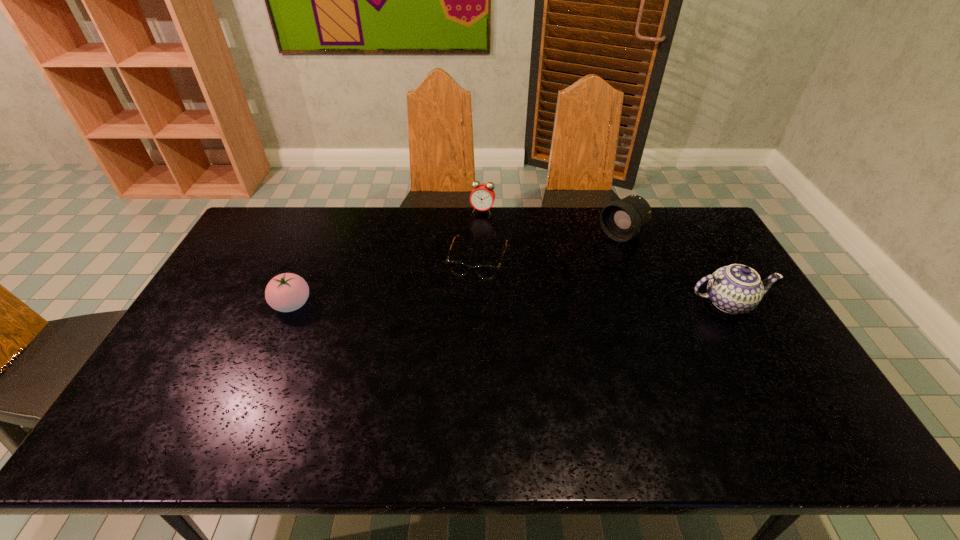
What are the coordinates of `vacant area situated 0.170m at the front element of the telephoto lens` in the screenshot? It's located at (575, 266).

Image resolution: width=960 pixels, height=540 pixels. In order to click on free region located 0.160m at the front element of the telephoto lens in this screenshot , I will do `click(577, 265)`.

You are a GUI agent. You are given a task and a screenshot of the screen. Output one action in this format:
    pyautogui.click(x=<x>, y=<y>)
    Task: Click on the vacant space situated at the front element of the telephoto lens
    The height and width of the screenshot is (540, 960).
    Given the screenshot: What is the action you would take?
    pyautogui.click(x=555, y=280)

The height and width of the screenshot is (540, 960). In order to click on free space located on the front-facing side of the alarm clock in this screenshot , I will do `click(477, 225)`.

Locate an element on the screen. free space located on the front-facing side of the alarm clock is located at coordinates (459, 289).

Identify the location of blank space located 0.270m on the front-facing side of the alarm clock. The image size is (960, 540). (467, 262).

Where is `spectacles that is at the far edge`? Image resolution: width=960 pixels, height=540 pixels. spectacles that is at the far edge is located at coordinates (487, 272).

Find the location of a particular element. The image size is (960, 540). telephoto lens present at the far edge is located at coordinates (621, 220).

This screenshot has width=960, height=540. What are the coordinates of `alarm clock at the far edge` in the screenshot? It's located at (482, 197).

At what (x,y) coordinates should I click in order to perform the action: click on object that is at the right edge. Please return your answer as a coordinate pair (x, y). This screenshot has width=960, height=540. Looking at the image, I should click on (735, 289).